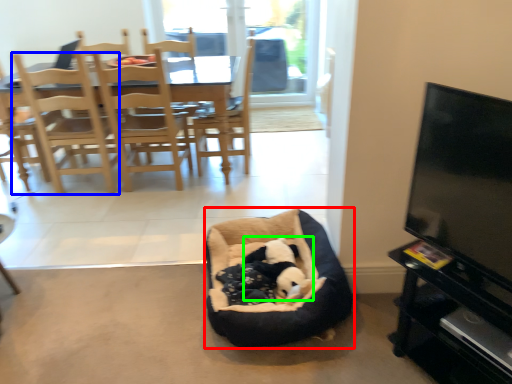
Question: Estimate the real-world distances between objects in this image. Which object is closer to dog bed (highlighted by a red box), chair (highlighted by a blue box) or animal (highlighted by a green box)?

Choices:
 (A) chair
 (B) animal

Answer: (B)